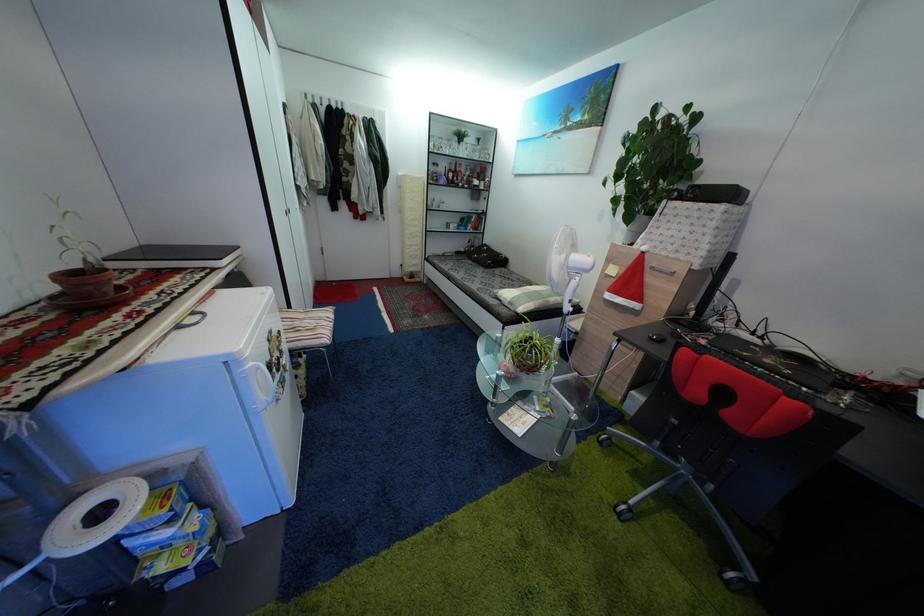
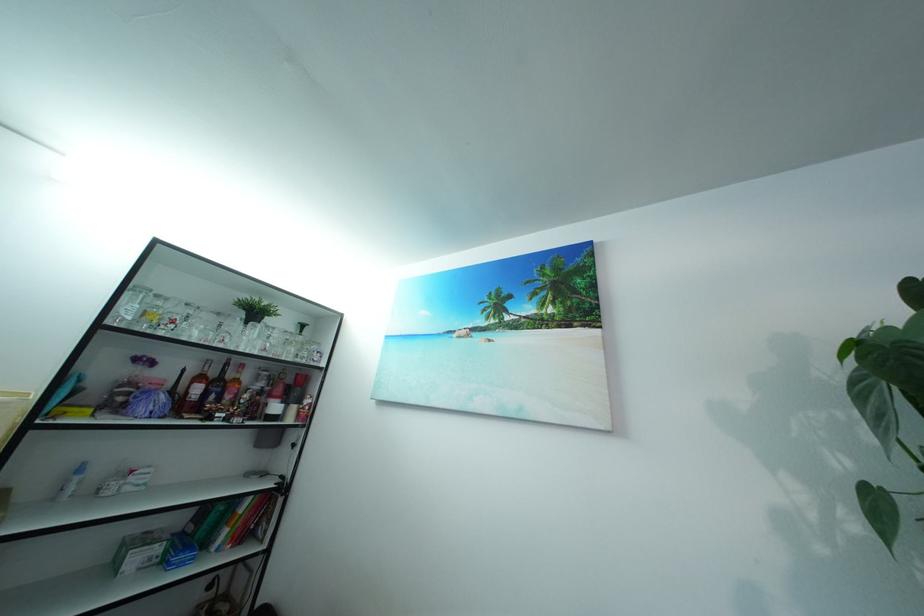
The point at [462,176] is marked in the first image. Where is the corresponding point in the second image?

(222, 381)